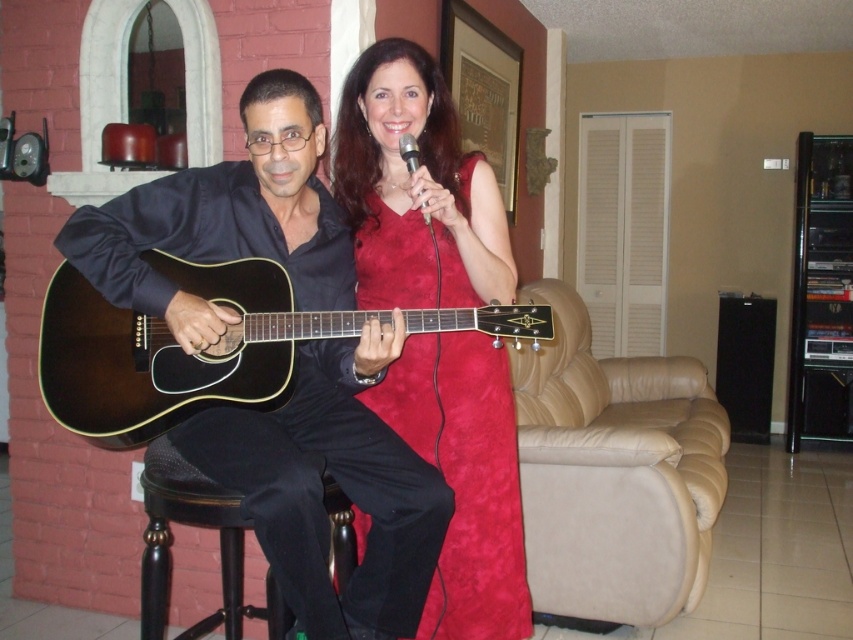
Can you confirm if shiny black guitar at left is bigger than velvet red dress at center?

Correct, shiny black guitar at left is larger in size than velvet red dress at center.

Who is shorter, shiny black guitar at left or velvet red dress at center?

velvet red dress at center is shorter.

This screenshot has width=853, height=640. Describe the element at coordinates (338, 483) in the screenshot. I see `shiny black guitar at left` at that location.

This screenshot has height=640, width=853. In order to click on shiny black guitar at left in this screenshot , I will do `click(338, 483)`.

In the scene shown: Is shiny black guitar at left thinner than matte black acoustic guitar at left?

Yes, shiny black guitar at left is thinner than matte black acoustic guitar at left.

Locate an element on the screen. This screenshot has height=640, width=853. shiny black guitar at left is located at coordinates click(x=338, y=483).

Find the location of a particular element. Image resolution: width=853 pixels, height=640 pixels. shiny black guitar at left is located at coordinates (338, 483).

Which is more to the left, velvet red dress at center or black wood bar stool at lower left?

black wood bar stool at lower left is more to the left.

Which of these two, velvet red dress at center or black wood bar stool at lower left, stands shorter?

With less height is black wood bar stool at lower left.

Is point (492, 605) in front of point (161, 531)?

Yes.

Locate an element on the screen. The height and width of the screenshot is (640, 853). velvet red dress at center is located at coordinates (463, 477).